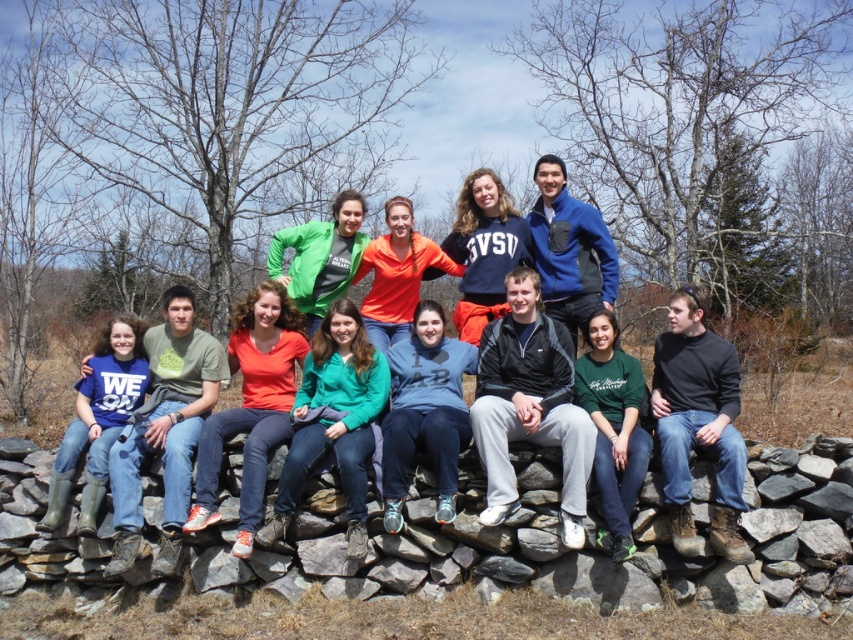
Based on the photo, does blue fleece sweatshirt at center have a lesser width compared to green matte sweatshirt at center?

In fact, blue fleece sweatshirt at center might be wider than green matte sweatshirt at center.

Based on the photo, is blue fleece sweatshirt at center smaller than green matte sweatshirt at center?

Incorrect, blue fleece sweatshirt at center is not smaller in size than green matte sweatshirt at center.

I want to click on blue fleece sweatshirt at center, so click(x=425, y=412).

Which is more to the left, green matte jacket at center or blue fleece sweatshirt at center?

green matte jacket at center is more to the left.

Is the position of green matte jacket at center more distant than that of blue fleece sweatshirt at center?

That is True.

Measure the distance between green matte jacket at center and camera.

The distance of green matte jacket at center from camera is 7.45 meters.

You are a GUI agent. You are given a task and a screenshot of the screen. Output one action in this format:
    pyautogui.click(x=<x>, y=<y>)
    Task: Click on the green matte jacket at center
    Image resolution: width=853 pixels, height=640 pixels.
    Given the screenshot: What is the action you would take?
    pyautogui.click(x=334, y=420)

Can you confirm if green matte jacket at center is thinner than green matte sweatshirt at center?

No.

Who is shorter, green matte jacket at center or green matte sweatshirt at center?

Standing shorter between the two is green matte sweatshirt at center.

The height and width of the screenshot is (640, 853). I want to click on green matte jacket at center, so click(334, 420).

Where is `green matte jacket at center`? green matte jacket at center is located at coordinates (334, 420).